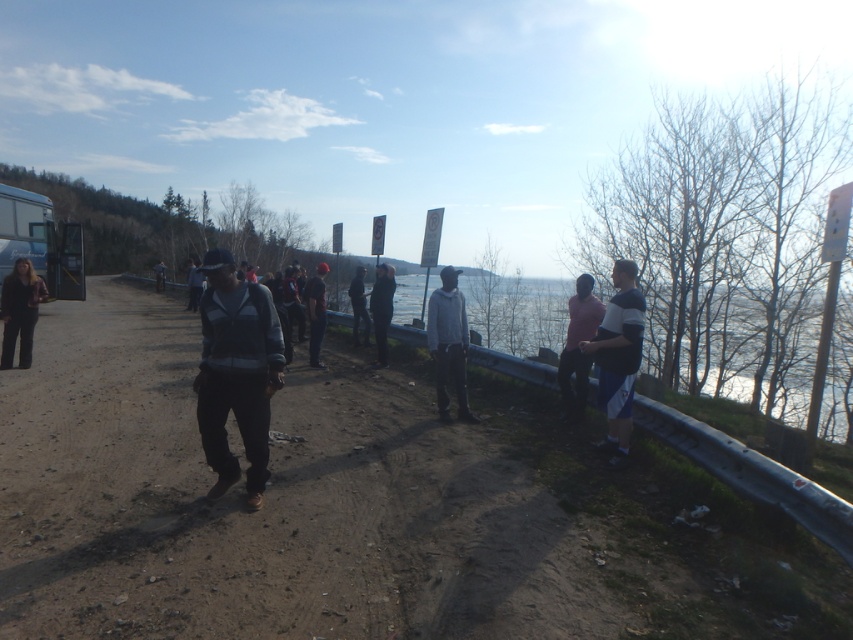
You are a photographer trying to capture a photo of the matte black jacket at left and the dark gray fabric jacket at center. Which jacket should you zoom in on to ensure both jackets are clearly visible in the frame?

The matte black jacket at left is larger in size than the dark gray fabric jacket at center, so you should zoom in on the matte black jacket at left to ensure both are clearly visible.

You are standing at the camera position and want to pick up the matte black jacket at left. Is it within a 30 feet distance?

The matte black jacket at left is 33.23 feet away from camera, so it is beyond the 30 feet distance.